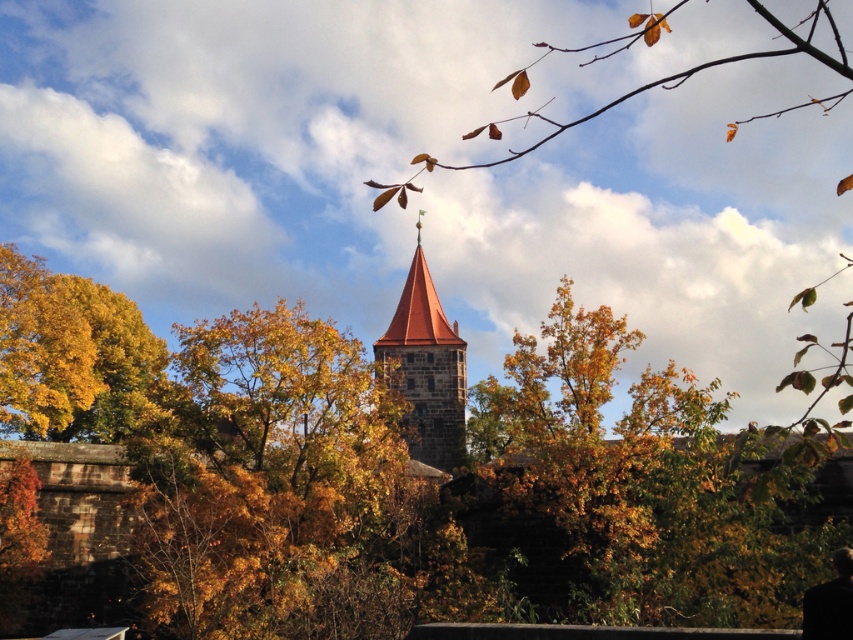
Question: Is yellow-green foliage at center positioned behind golden foliage at center?

Choices:
 (A) yes
 (B) no

Answer: (B)

Question: Considering the real-world distances, which object is closest to the yellow-green foliage at center?

Choices:
 (A) smooth stone tower at center
 (B) black matte jacket at lower right

Answer: (A)

Question: Among these objects, which one is farthest from the camera?

Choices:
 (A) black matte jacket at lower right
 (B) smooth stone tower at center
 (C) yellow-green foliage at center

Answer: (B)

Question: Does yellow-green foliage at center have a larger size compared to black matte jacket at lower right?

Choices:
 (A) yes
 (B) no

Answer: (A)

Question: Which object appears farthest from the camera in this image?

Choices:
 (A) yellow-green foliage at center
 (B) black matte jacket at lower right

Answer: (B)

Question: Considering the relative positions of smooth stone tower at center and black matte jacket at lower right in the image provided, where is smooth stone tower at center located with respect to black matte jacket at lower right?

Choices:
 (A) above
 (B) below

Answer: (A)